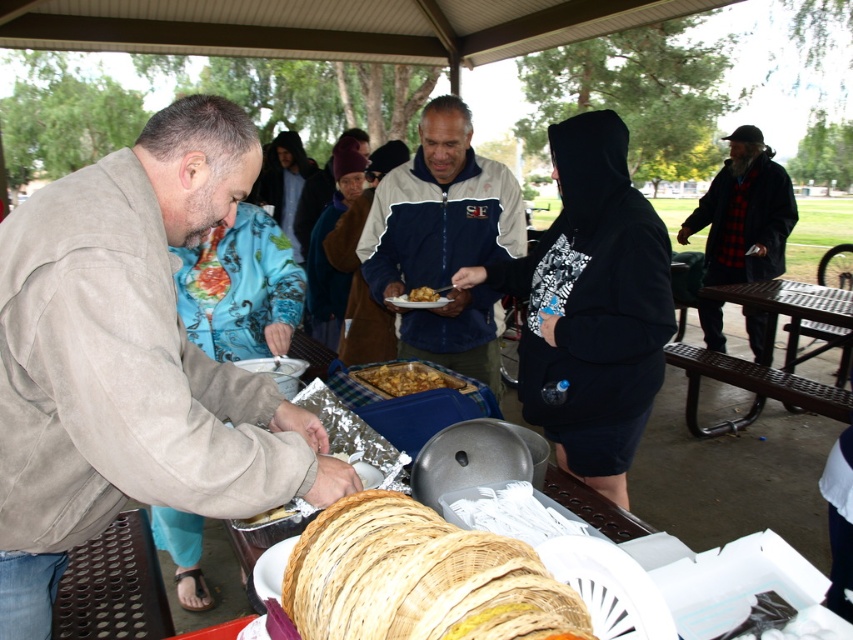
Question: Can you confirm if navy blue jacket at center is bigger than flannel shirt at right?

Choices:
 (A) no
 (B) yes

Answer: (A)

Question: Is suede beige jacket at left in front of brown metal picnic table at right?

Choices:
 (A) yes
 (B) no

Answer: (A)

Question: Considering the real-world distances, which object is closest to the brown metal picnic table at right?

Choices:
 (A) flannel shirt at right
 (B) golden brown bread at center

Answer: (A)

Question: Which object is closer to the camera taking this photo?

Choices:
 (A) navy blue jacket at center
 (B) suede beige jacket at left
 (C) golden brown bread at center
 (D) golden brown crumbly at center

Answer: (B)

Question: Does golden brown bread at center appear over golden brown crumbly at center?

Choices:
 (A) no
 (B) yes

Answer: (A)

Question: Considering the real-world distances, which object is closest to the golden brown crumbly at center?

Choices:
 (A) golden brown bread at center
 (B) suede beige jacket at left
 (C) slightly browned plastic container at center

Answer: (C)